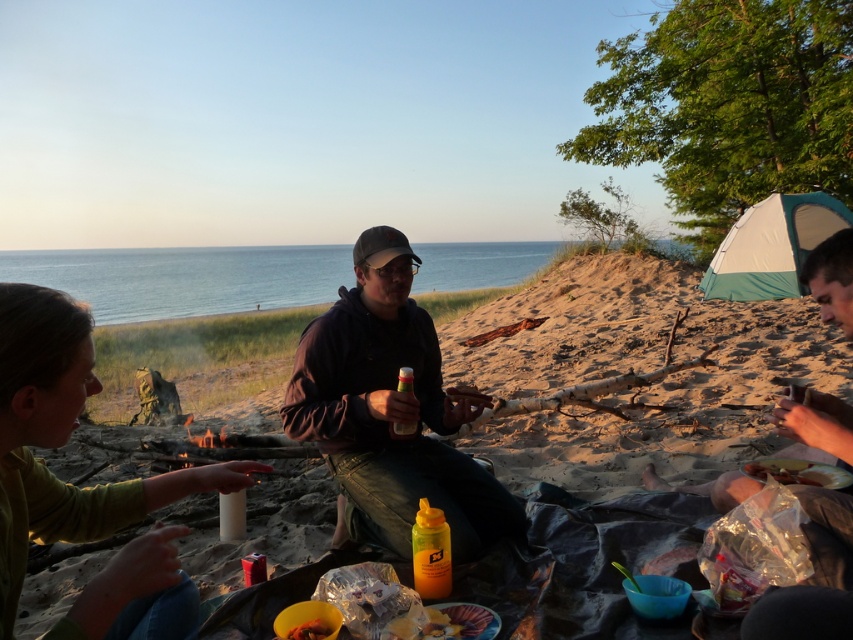
Question: Does matte black jacket at right come behind yellow plastic bottle at center?

Choices:
 (A) yes
 (B) no

Answer: (B)

Question: Which point is closer to the camera?

Choices:
 (A) smooth sand beach at center
 (B) green matte shirt at lower left
 (C) translucent plastic cup at center

Answer: (B)

Question: Estimate the real-world distances between objects in this image. Which object is closer to the translucent plastic cup at center?

Choices:
 (A) green matte shirt at lower left
 (B) shiny plastic container at lower center
 (C) yellow plastic bottle at center

Answer: (C)

Question: Does dark brown leather jacket at center have a lesser width compared to shiny plastic container at lower center?

Choices:
 (A) yes
 (B) no

Answer: (B)

Question: Which of the following is the farthest from the observer?

Choices:
 (A) dark brown leather jacket at center
 (B) shiny plastic bag at lower right

Answer: (A)

Question: Is the position of smooth sand beach at center less distant than that of shiny plastic bag at lower right?

Choices:
 (A) yes
 (B) no

Answer: (A)